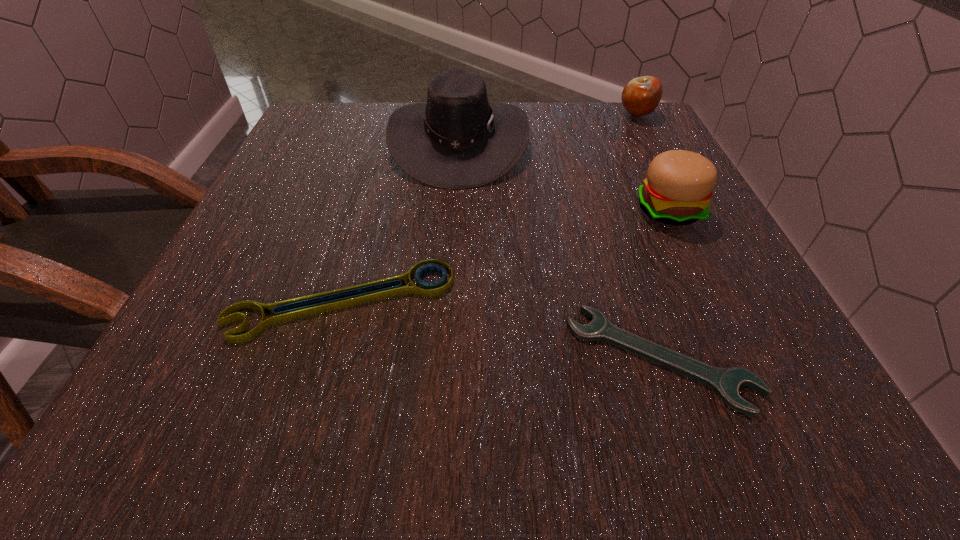
Find the location of a particular element. This screenshot has height=540, width=960. free space between the apple and the cowboy hat is located at coordinates (548, 129).

Image resolution: width=960 pixels, height=540 pixels. What are the coordinates of `vacant space in between the cowboy hat and the left wrench` in the screenshot? It's located at (400, 221).

Where is `unoccupied area between the tallest object and the right wrench`? unoccupied area between the tallest object and the right wrench is located at coordinates (560, 250).

Identify the location of blank region between the right wrench and the cowboy hat. (560, 250).

The width and height of the screenshot is (960, 540). Identify the location of unoccupied position between the hamburger and the right wrench. (664, 284).

Where is `vacant region between the right wrench and the apple`? The width and height of the screenshot is (960, 540). vacant region between the right wrench and the apple is located at coordinates (649, 237).

Identify which object is the second closest to the right wrench. Please provide its 2D coordinates. Your answer should be formatted as a tuple, i.e. [(x, y)], where the tuple contains the x and y coordinates of a point satisfying the conditions above.

[(677, 191)]

Where is `object that stands as the second closest to the tallest object`? Image resolution: width=960 pixels, height=540 pixels. object that stands as the second closest to the tallest object is located at coordinates (287, 310).

The height and width of the screenshot is (540, 960). In order to click on vacant space that satisfies the following two spatial constraints: 1. on the front-facing side of the third nearest object; 2. on the right side of the tallest object in this screenshot , I will do pos(455,210).

Find the location of `free space in the image that satisfies the following two spatial constraints: 1. on the back side of the fourth shortest object; 2. on the left side of the right wrench`. free space in the image that satisfies the following two spatial constraints: 1. on the back side of the fourth shortest object; 2. on the left side of the right wrench is located at coordinates (611, 210).